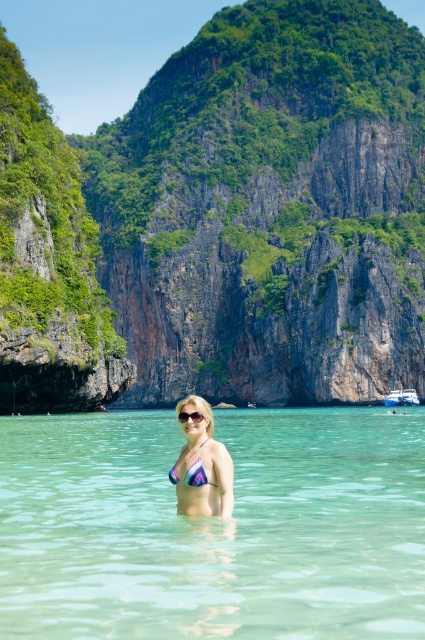
Question: In this image, where is clear water at center located relative to white glossy boat at center?

Choices:
 (A) above
 (B) below

Answer: (A)

Question: Can you confirm if clear water at center is bigger than multicolored bikini at center?

Choices:
 (A) no
 (B) yes

Answer: (B)

Question: Among these points, which one is nearest to the camera?

Choices:
 (A) (190, 500)
 (B) (172, 477)
 (C) (393, 394)

Answer: (A)

Question: Which of the following is the closest to the observer?

Choices:
 (A) transparent plastic goggles at center
 (B) white glossy boat at center

Answer: (A)

Question: Which of these objects is positioned closest to the multicolored bikini at center?

Choices:
 (A) multicolored fabric bikini at center
 (B) white glossy boat at center

Answer: (A)

Question: Considering the relative positions of multicolored bikini at center and transparent plastic goggles at center in the image provided, where is multicolored bikini at center located with respect to transparent plastic goggles at center?

Choices:
 (A) above
 (B) below

Answer: (B)